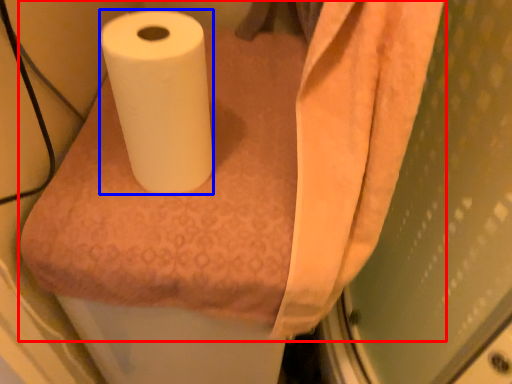
Question: Which object appears farthest to the camera in this image, paper towel (highlighted by a red box) or toilet paper (highlighted by a blue box)?

Choices:
 (A) paper towel
 (B) toilet paper

Answer: (A)